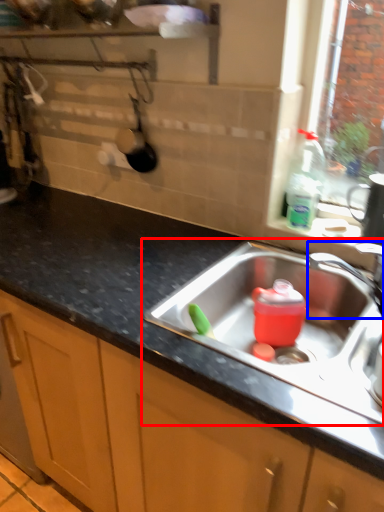
Question: Among these objects, which one is nearest to the camera, sink (highlighted by a red box) or tap (highlighted by a blue box)?

Choices:
 (A) sink
 (B) tap

Answer: (A)